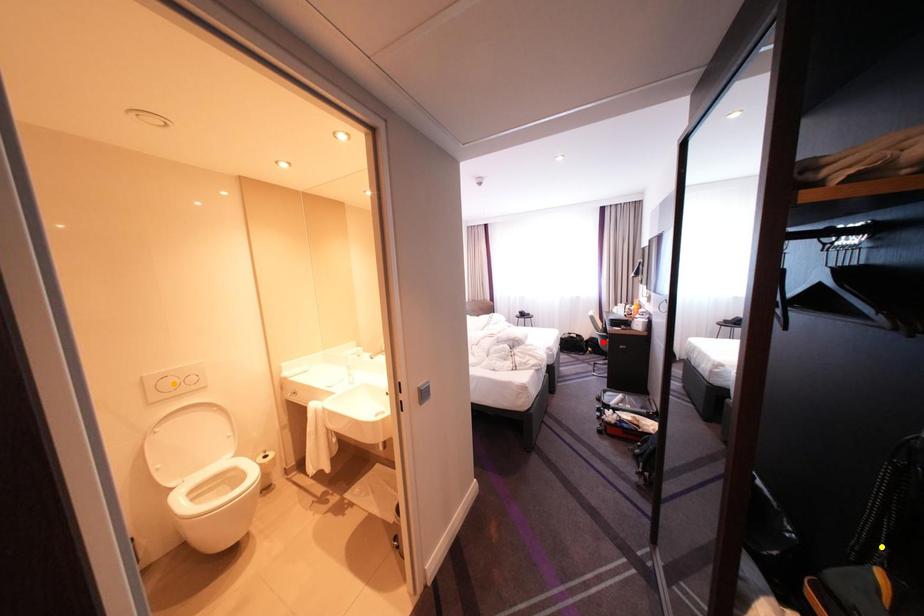
Order these from nearest to farthest:
yellow point, red point, orange point

yellow point < orange point < red point